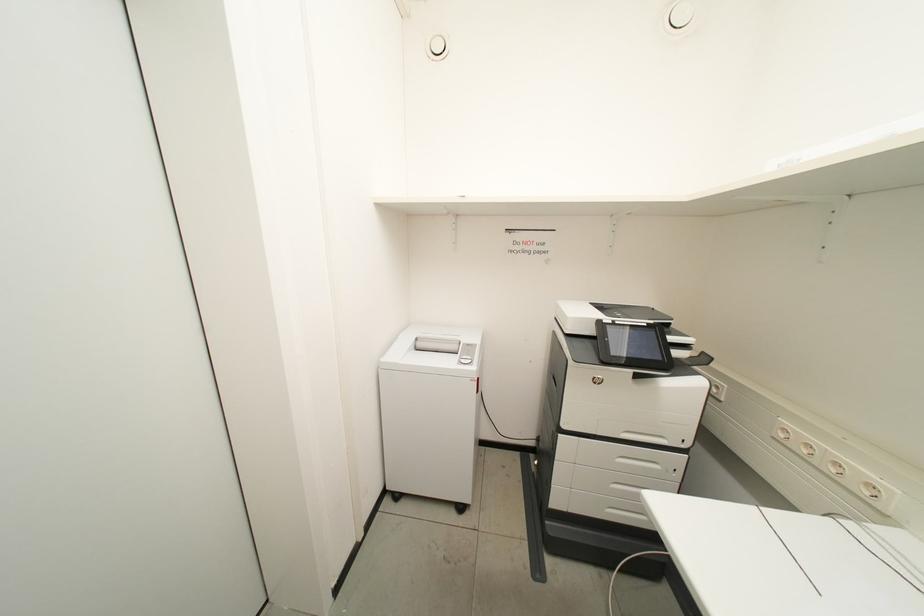
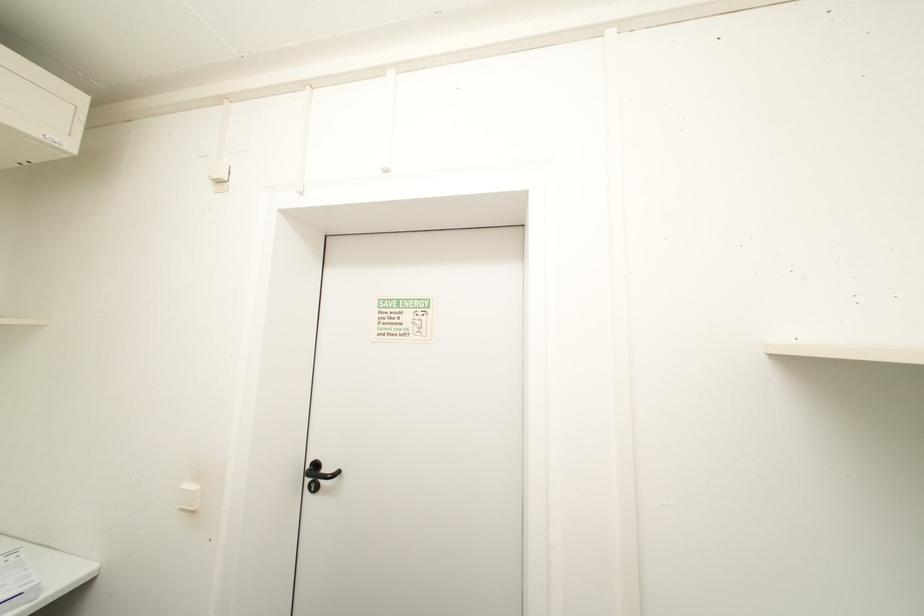
Question: Based on the continuous images, in which direction is the camera rotating? Reply with the corresponding letter.

Choices:
 (A) Left
 (B) Right
 (C) Up
 (D) Down

Answer: (A)